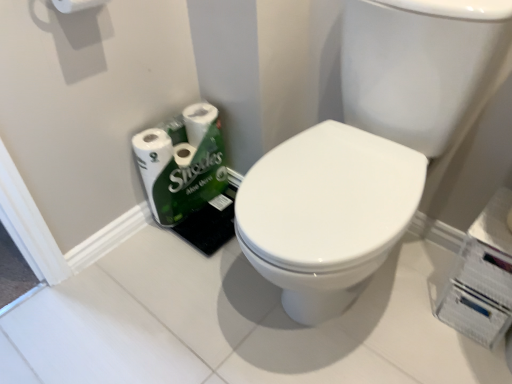
Find the location of a particular element. free spot in front of white glossy toilet paper at lower left, the first toilet paper when ordered from back to front is located at coordinates (191, 254).